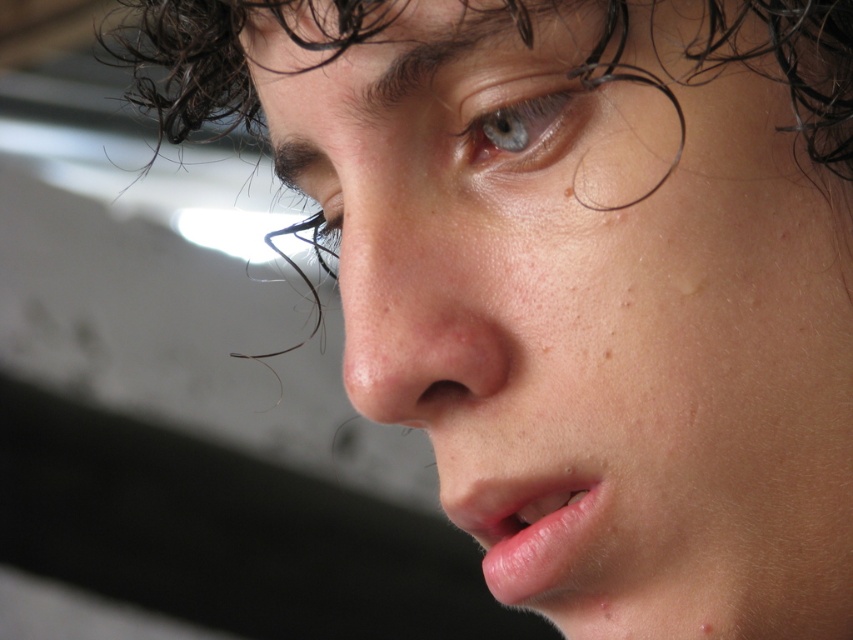
You are a photographer adjusting the lighting for a portrait. The subject has a smooth skin face at center and a blue glossy eye at upper center. Based on their sizes, which object should you focus on to ensure proper exposure for the main subject?

The smooth skin face at center has a larger width than the blue glossy eye at upper center, so you should focus on the smooth skin face at center to ensure proper exposure for the main subject.

You are a makeup artist preparing to apply lipstick. You notice the pink glossy lips at lower center and the brown matte freckle at lower right. Which feature is bigger in size?

The pink glossy lips at lower center is larger in size than the brown matte freckle at lower right.